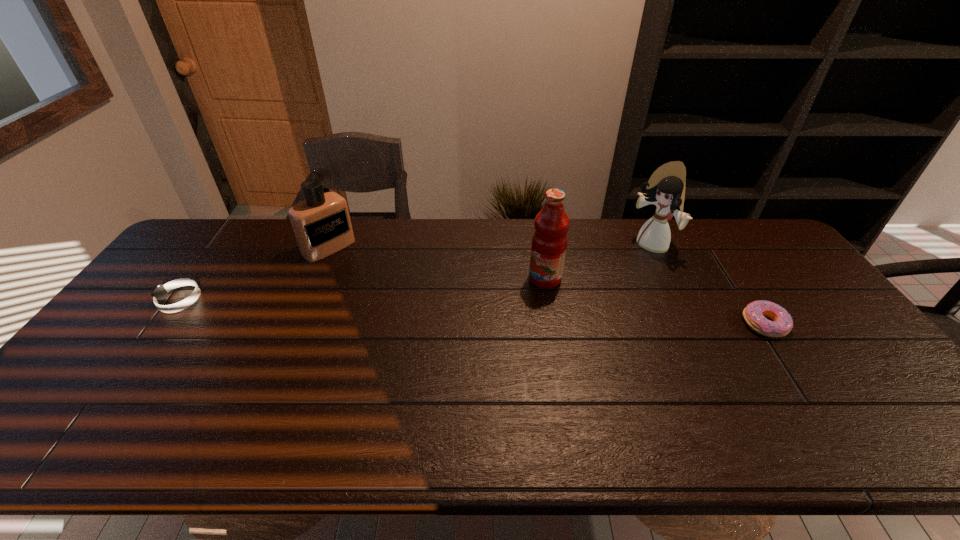
Find the location of a particular element. object situated at the right edge is located at coordinates (753, 314).

Find the location of a particular element. The width and height of the screenshot is (960, 540). blank area at the far edge is located at coordinates (699, 233).

In the image, there is a desktop. Identify the location of vacant space at the near edge. The image size is (960, 540). (246, 411).

The height and width of the screenshot is (540, 960). What are the coordinates of `free region at the left edge of the desktop` in the screenshot? It's located at (105, 374).

Locate an element on the screen. The width and height of the screenshot is (960, 540). free space at the far left corner of the desktop is located at coordinates (186, 256).

Where is `free space at the far right corner`? free space at the far right corner is located at coordinates (728, 218).

In the image, there is a desktop. Identify the location of free space at the near right corner. This screenshot has height=540, width=960. (873, 380).

You are a GUI agent. You are given a task and a screenshot of the screen. Output one action in this format:
    pyautogui.click(x=<x>, y=<y>)
    Task: Click on the vacant area between the doll and the fruit juice
    The height and width of the screenshot is (540, 960).
    Given the screenshot: What is the action you would take?
    pyautogui.click(x=598, y=262)

At what (x,y) coordinates should I click in order to perform the action: click on free point between the doll and the leftmost object. Please return your answer as a coordinate pair (x, y). Looking at the image, I should click on (416, 273).

Image resolution: width=960 pixels, height=540 pixels. In order to click on free space between the wristband and the fruit juice in this screenshot , I will do `click(363, 289)`.